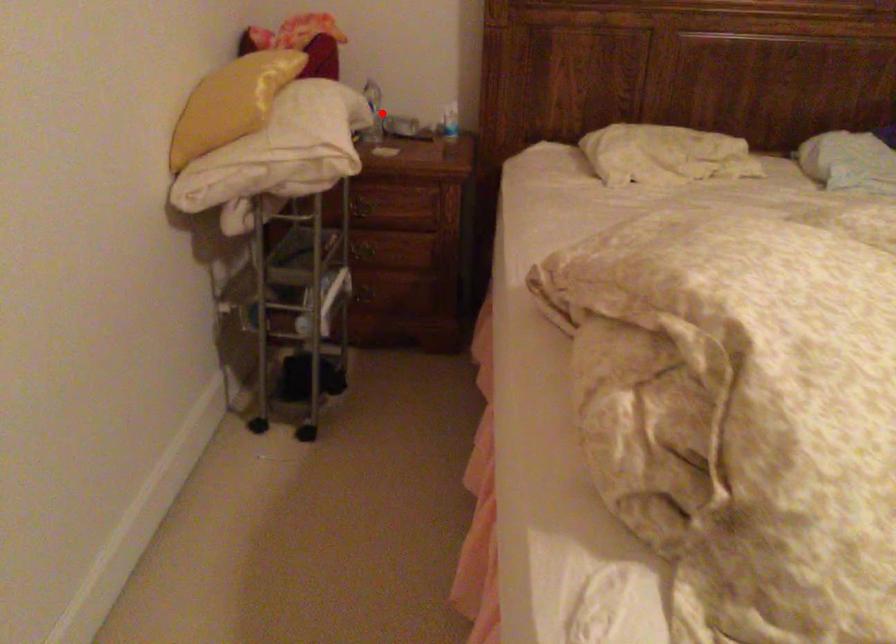
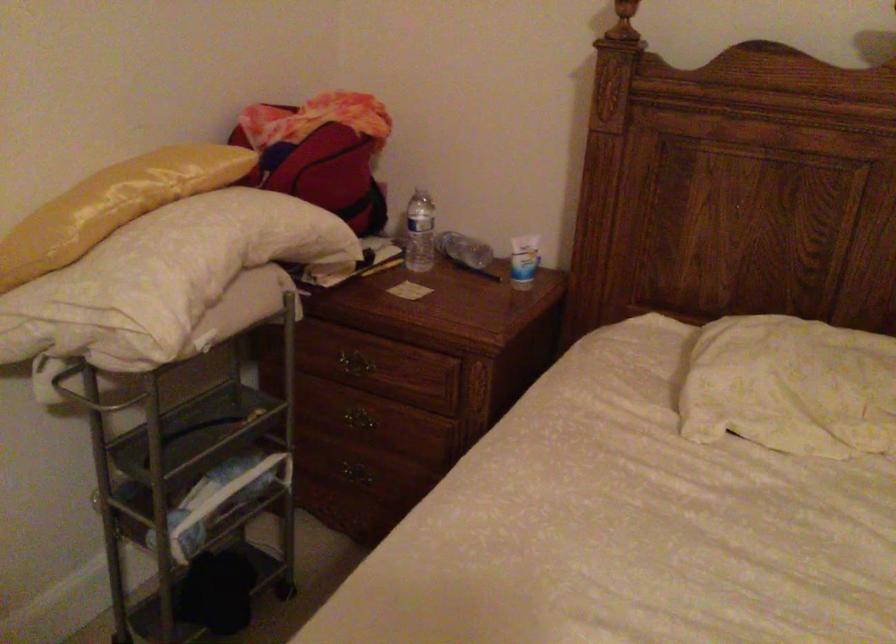
Question: I am providing you with two images of the same scene from different viewpoints. In image1, a red point is highlighted. Considering the same 3D point in image2, which of the following is correct?

Choices:
 (A) It is closer
 (B) It is farther

Answer: (A)